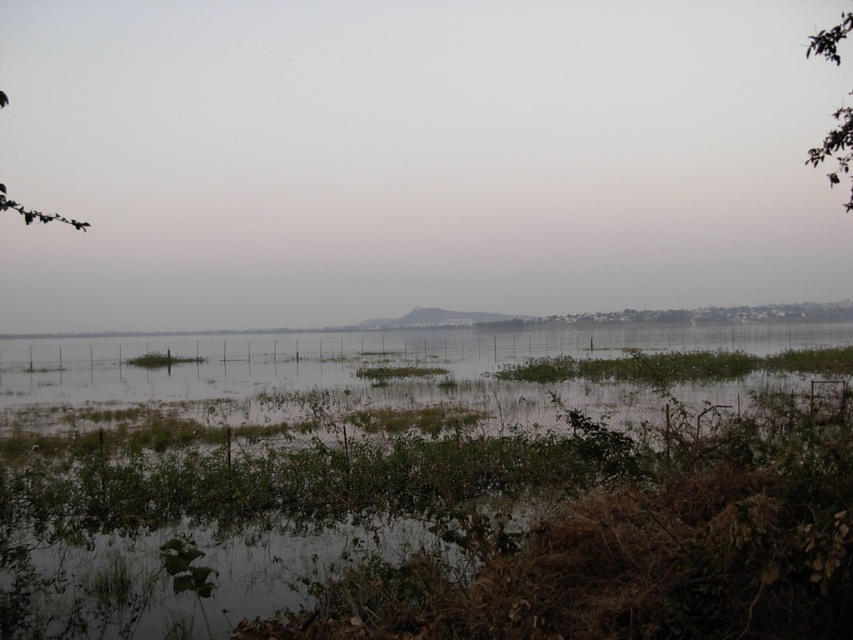
Question: Is green leafy tree at upper right thinner than green leafy branch at upper left?

Choices:
 (A) no
 (B) yes

Answer: (A)

Question: Which of the following is the closest to the observer?

Choices:
 (A) green leafy branch at upper left
 (B) green leafy tree at upper right

Answer: (A)

Question: Is green leafy tree at upper right wider than green leafy branch at upper left?

Choices:
 (A) yes
 (B) no

Answer: (A)

Question: Which of the following is the closest to the observer?

Choices:
 (A) green leafy tree at upper right
 (B) green leafy branch at upper left

Answer: (B)

Question: Is green leafy tree at upper right further to the viewer compared to green leafy branch at upper left?

Choices:
 (A) yes
 (B) no

Answer: (A)